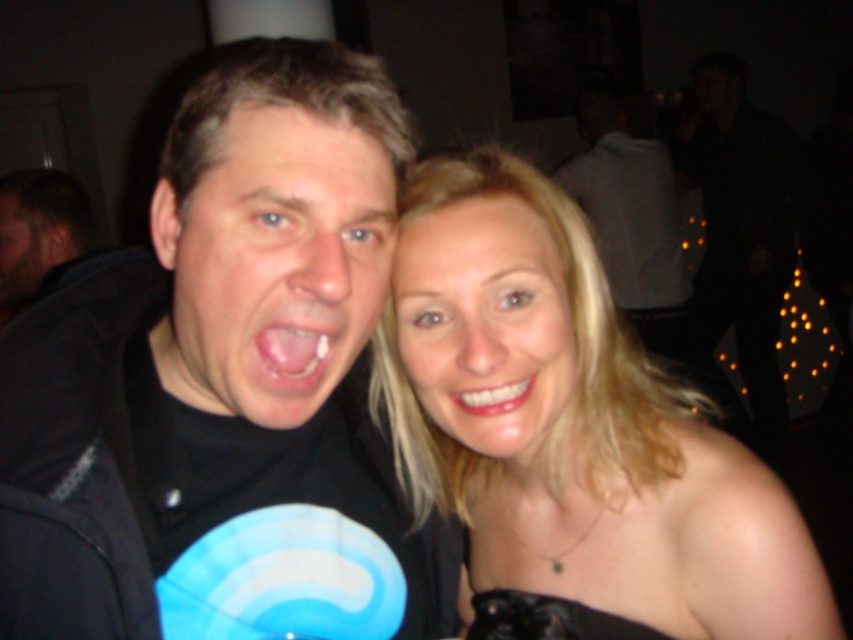
Question: Which point appears farthest from the camera in this image?

Choices:
 (A) (218, 228)
 (B) (218, 289)
 (C) (576, 346)

Answer: (C)

Question: Does dark brown hair at left appear on the left side of white glossy teeth at center?

Choices:
 (A) no
 (B) yes

Answer: (B)

Question: Among these objects, which one is farthest from the camera?

Choices:
 (A) pink glossy tongue at center
 (B) black matte t-shirt at center

Answer: (A)

Question: Does blonde hair at upper right appear under matte black face at center?

Choices:
 (A) yes
 (B) no

Answer: (A)

Question: Which of the following is the closest to the observer?

Choices:
 (A) smooth skin face at center
 (B) white glossy teeth at center
 (C) white matte shirt at upper center
 (D) black matte t-shirt at center

Answer: (D)

Question: Where is black matte t-shirt at center located in relation to white glossy teeth at center in the image?

Choices:
 (A) left
 (B) right

Answer: (A)